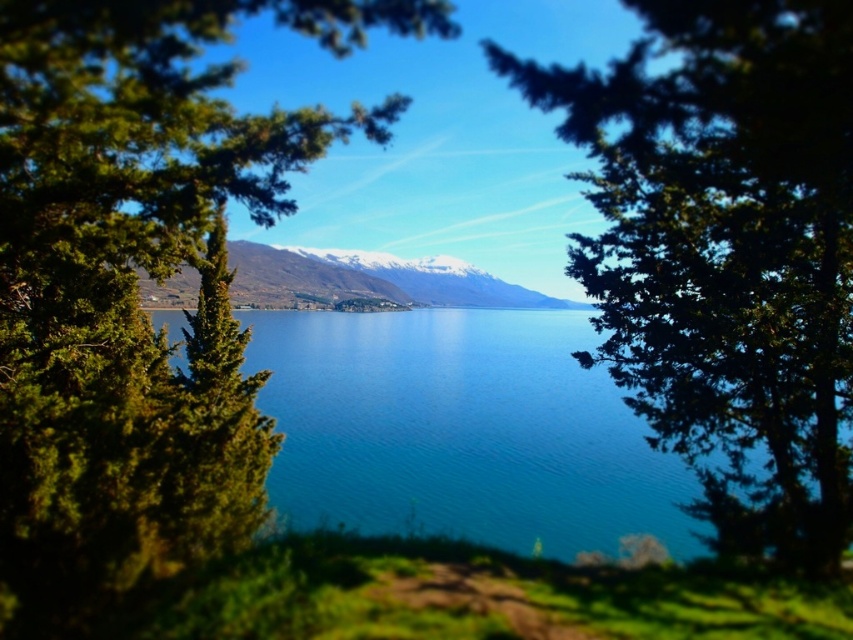
Is point (222, 451) closer to viewer compared to point (456, 280)?

Yes, it is in front of point (456, 280).

Which is above, green leafy tree at center or snowy mountain at center?

Positioned higher is snowy mountain at center.

Does point (54, 243) come behind point (325, 300)?

No, (54, 243) is closer to viewer.

I want to click on green leafy tree at center, so click(x=136, y=284).

Between blue glassy water at center and snowy mountain at center, which one appears on the left side from the viewer's perspective?

snowy mountain at center

Find the location of a particular element. Image resolution: width=853 pixels, height=640 pixels. blue glassy water at center is located at coordinates point(461,429).

Does green leafy tree at upper center appear on the left side of snowy mountain at center?

No, green leafy tree at upper center is not to the left of snowy mountain at center.

Between green leafy tree at upper center and snowy mountain at center, which one is positioned higher?

snowy mountain at center

This screenshot has height=640, width=853. I want to click on green leafy tree at upper center, so click(726, 252).